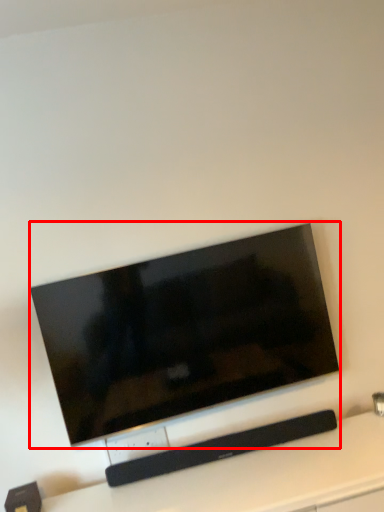
Question: Considering the relative positions of television (annotated by the red box) and furniture in the image provided, where is television (annotated by the red box) located with respect to the staircase?

Choices:
 (A) right
 (B) left

Answer: (B)